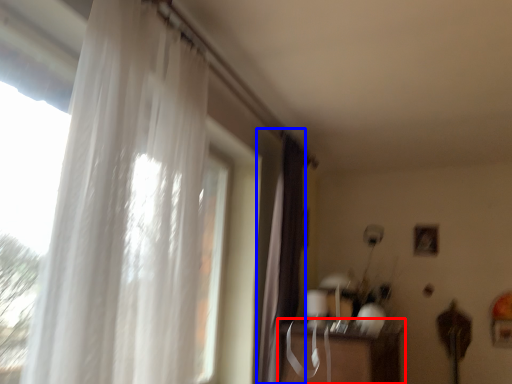
Question: Which point is further to the camera, table (highlighted by a red box) or curtain (highlighted by a blue box)?

Choices:
 (A) table
 (B) curtain

Answer: (B)